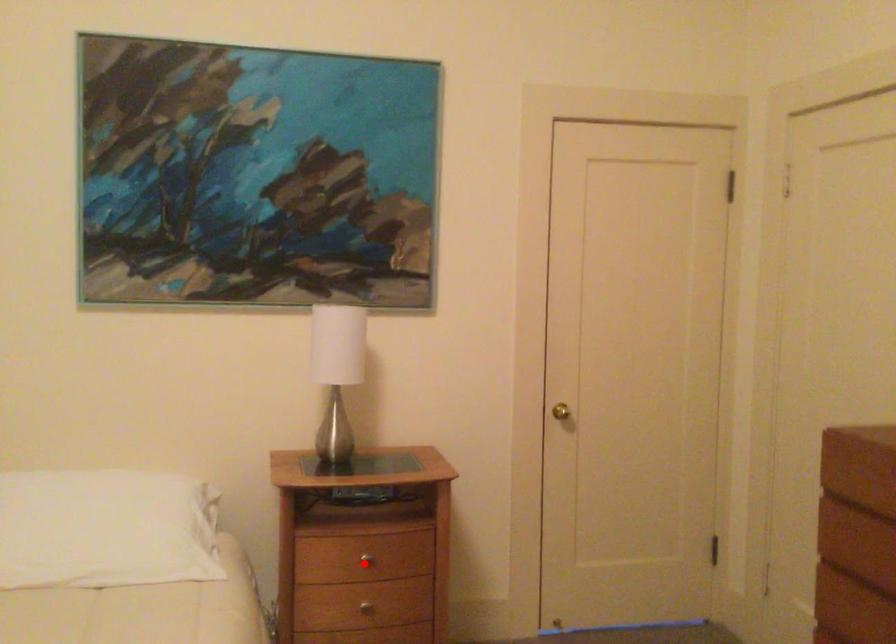
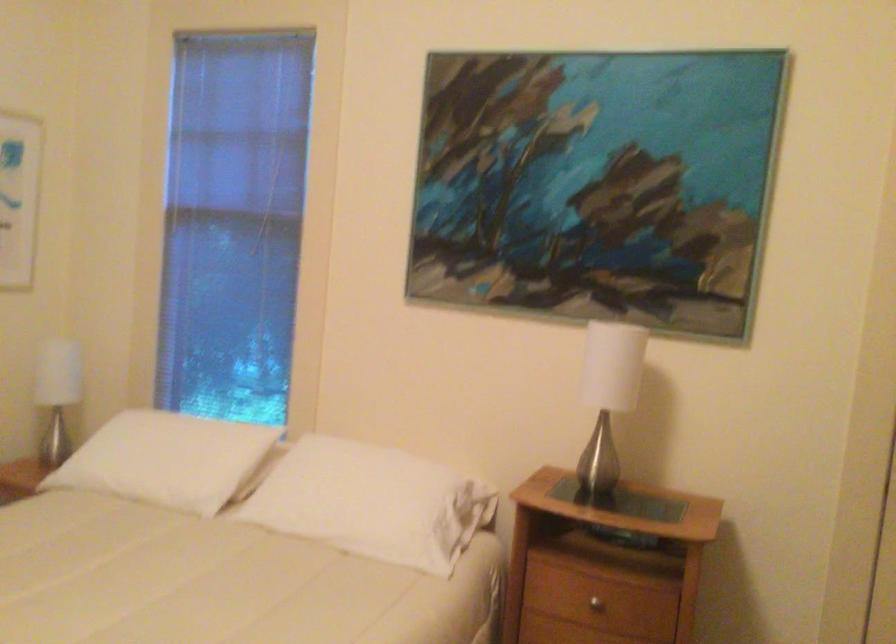
The point at the highlighted location is marked in the first image. Where is the corresponding point in the second image?

(597, 601)